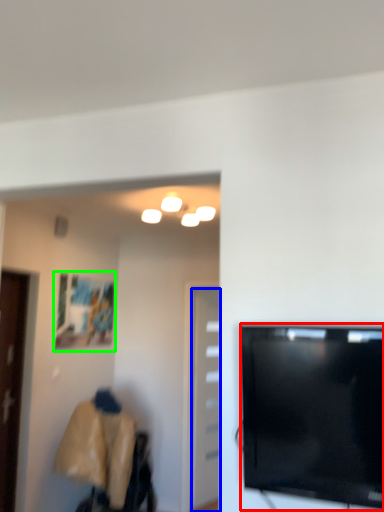
Question: Which is nearer to the television (highlighted by a red box)? door (highlighted by a blue box) or picture frame (highlighted by a green box).

Choices:
 (A) door
 (B) picture frame

Answer: (B)